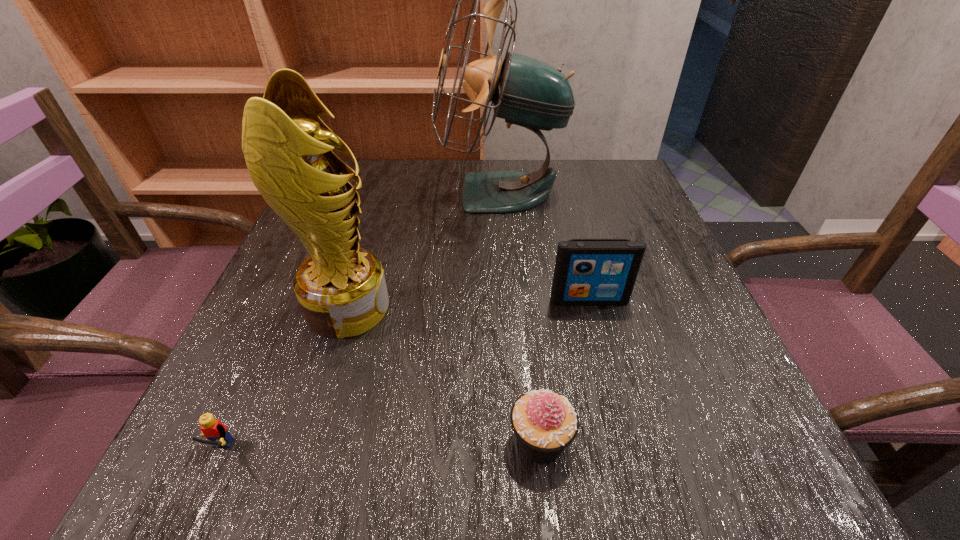
Locate an element on the screen. This screenshot has width=960, height=540. vacant space located 0.050m on the front screen of the iPod is located at coordinates (596, 327).

Identify the location of free space located 0.060m on the back of the cupcake. (534, 377).

Find the location of a particular element. object located in the far edge section of the desktop is located at coordinates (527, 92).

Locate an element on the screen. The width and height of the screenshot is (960, 540). cupcake that is at the near edge is located at coordinates (544, 422).

The image size is (960, 540). I want to click on Lego that is at the near edge, so click(x=214, y=430).

Where is `award that is at the left edge`? The width and height of the screenshot is (960, 540). award that is at the left edge is located at coordinates (341, 288).

Find the location of `Lego present at the left edge`. Lego present at the left edge is located at coordinates (214, 430).

You are a GUI agent. You are given a task and a screenshot of the screen. Output one action in this format:
    pyautogui.click(x=<x>, y=<y>)
    Task: Click on the object that is at the right edge
    The image size is (960, 540).
    Given the screenshot: What is the action you would take?
    pyautogui.click(x=587, y=271)

This screenshot has width=960, height=540. I want to click on object that is at the near left corner, so coord(214,430).

What are the coordinates of `vacant space at the far edge` in the screenshot? It's located at (549, 202).